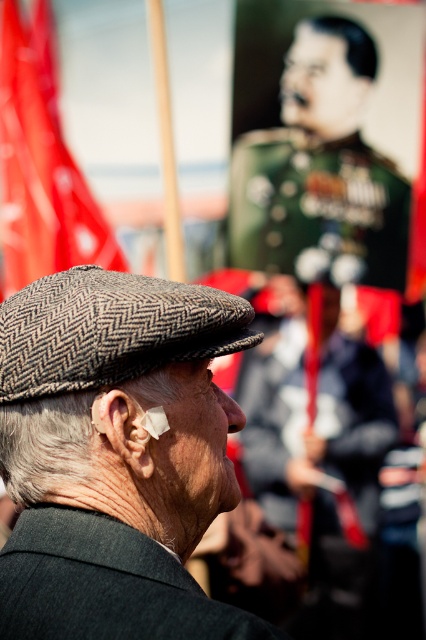
You are a photographer at the event. You need to capture a photo where both the gray herringbone flat cap at center and the green military uniform at upper center are clearly visible. Can you position yourself so that neither object blocks the other?

Yes, since the gray herringbone flat cap at center is in front of the green military uniform at upper center, you can move to the side so that the cap is no longer directly in front of the uniform, allowing both to be visible without obstruction.

You are an event organizer at the commemorative gathering. You need to place a small decoration exactly at point (x=106, y=584). According to the scene description, where should you place the decoration?

The point (x=106, y=584) is on the dark gray woolen suit at center, so you should place the decoration on the dark gray woolen suit at center.

You are a photographer at the event and need to ensure both the dark gray woolen suit at center and the herringbone fabric hat at center are visible in your photo. Which object should you focus on to capture both without cropping?

The dark gray woolen suit at center has a smaller size compared to herringbone fabric hat at center, so focusing on the dark gray woolen suit at center would ensure both objects are visible without cropping.